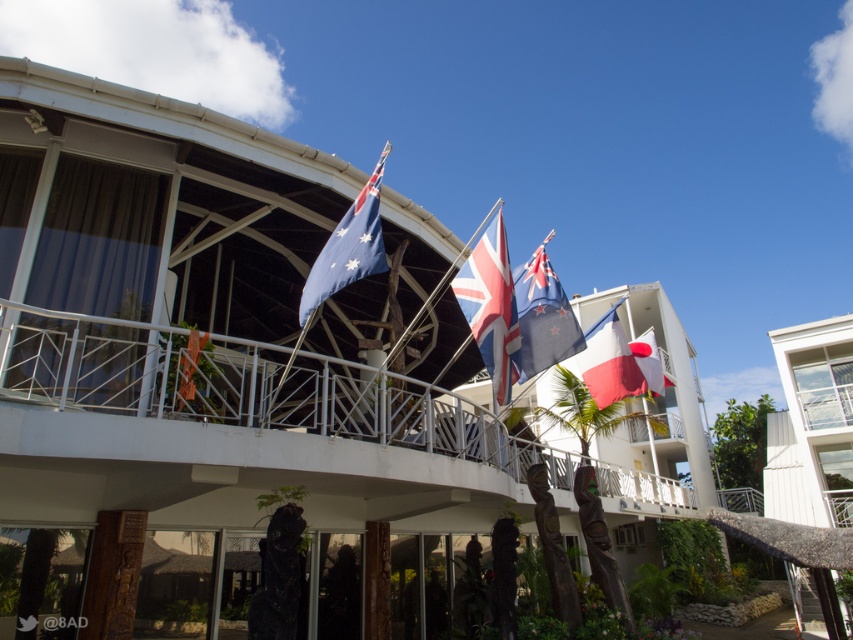
Does point (531, 355) come farther from viewer compared to point (595, 376)?

No, it is in front of (595, 376).

Who is higher up, white woolen flag at center or matte white flag at center?

white woolen flag at center

In order to click on white woolen flag at center in this screenshot , I will do `click(541, 317)`.

The width and height of the screenshot is (853, 640). I want to click on white woolen flag at center, so click(x=541, y=317).

Identify the location of white metal balcony at center. This screenshot has width=853, height=640. tap(248, 388).

Does red and white fabric flag at center have a greater width compared to matte white flag at center?

No.

In the scene shown: Can you confirm if red and white fabric flag at center is taller than matte white flag at center?

Indeed, red and white fabric flag at center has a greater height compared to matte white flag at center.

This screenshot has height=640, width=853. Describe the element at coordinates (490, 305) in the screenshot. I see `red and white fabric flag at center` at that location.

You are a GUI agent. You are given a task and a screenshot of the screen. Output one action in this format:
    pyautogui.click(x=<x>, y=<y>)
    Task: Click on the red and white fabric flag at center
    This screenshot has height=640, width=853.
    Given the screenshot: What is the action you would take?
    pyautogui.click(x=490, y=305)